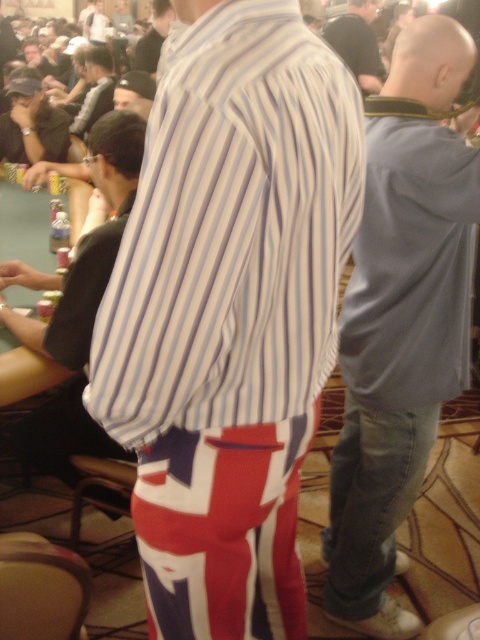
You are a photographer at the poker tournament and want to capture a closeup of the striped cotton shirt at center. Based on its position, which direction should you move your camera to focus on it?

The striped cotton shirt at center is located at point 0.364 on the x axis and 0.485 on the y axis. To focus on it, move the camera to the right and down slightly since the shirt is positioned to the right and lower part of the image.

You are a photographer positioned to capture the poker tournament scene. You need to ensure that the matte black cap at upper left is visible in your shot. Given its coordinates at point 0.192, 0.067, where should you position your camera relative to the scene?

The matte black cap at upper left is located at point (32, 122), so positioning the camera to include the upper left area of the scene will ensure the cap is visible.

You are a photographer at the event and want to capture a photo of the striped cotton shirt at center and the matte black cap at upper left. From the photographer perspective, which object is positioned more to the right?

The striped cotton shirt at center is positioned to the right of the matte black cap at upper left, so the striped cotton shirt at center is more to the right.